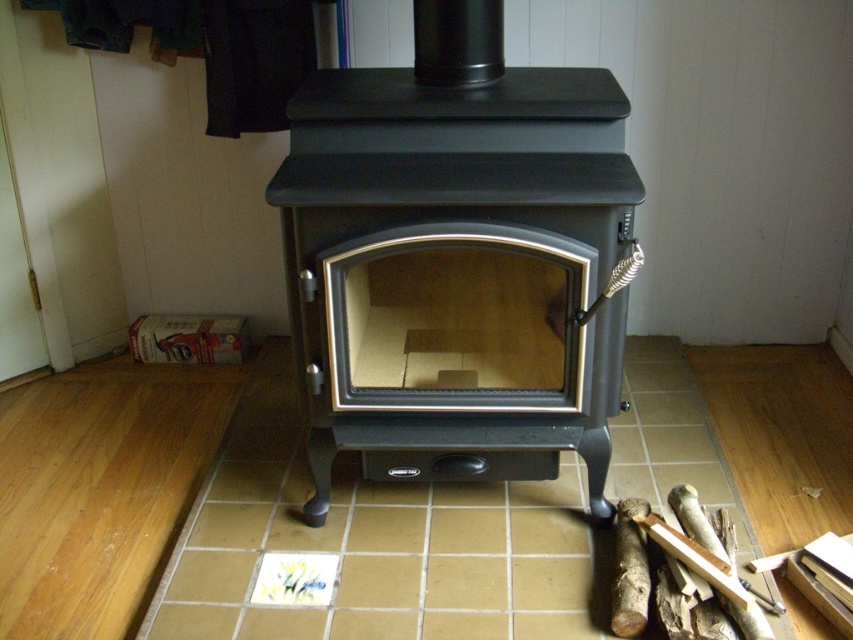
Question: Which point is farther to the camera?

Choices:
 (A) brown wood log at lower right
 (B) matte black stove at center

Answer: (A)

Question: Is matte black stove at center bigger than brown wood log at lower right?

Choices:
 (A) yes
 (B) no

Answer: (A)

Question: Which of the following is the farthest from the observer?

Choices:
 (A) brown wood log at lower right
 (B) matte black stove at center

Answer: (A)

Question: Is matte black stove at center smaller than brown wood log at lower right?

Choices:
 (A) yes
 (B) no

Answer: (B)

Question: Is matte black stove at center to the right of brown wood log at lower right from the viewer's perspective?

Choices:
 (A) no
 (B) yes

Answer: (A)

Question: Which of the following is the closest to the observer?

Choices:
 (A) brown wood log at lower right
 (B) matte black stove at center

Answer: (B)